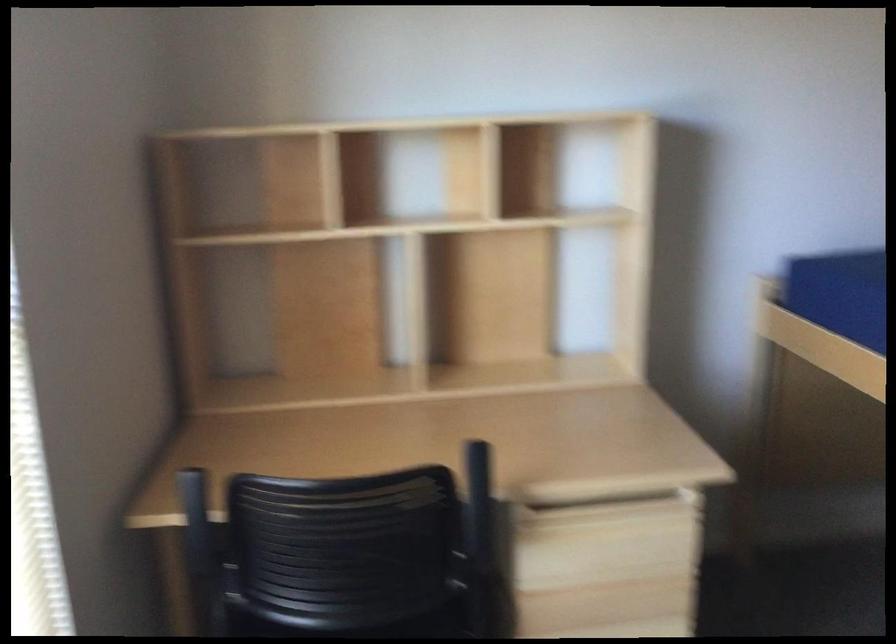
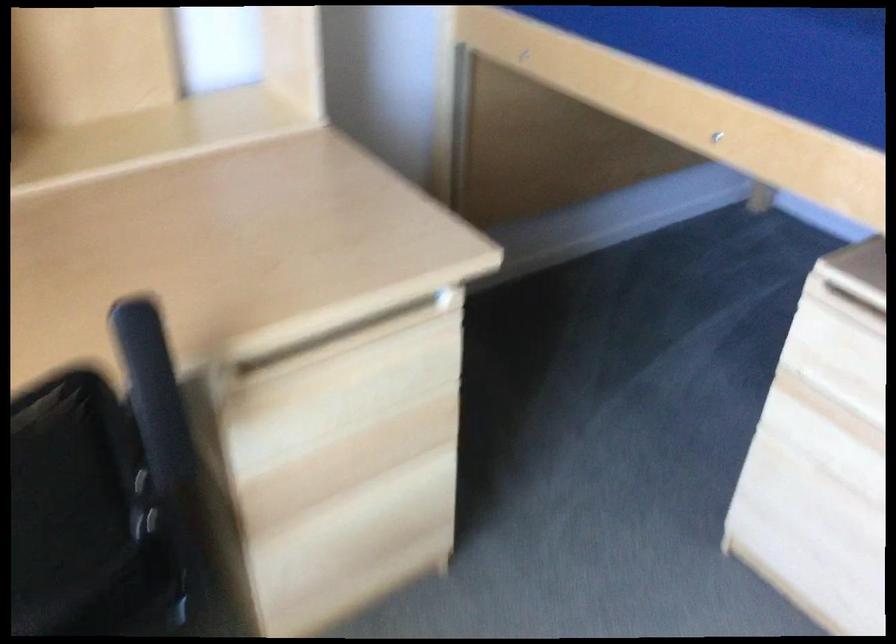
First-person continuous shooting, in which direction is the camera rotating?

The camera rotated toward right-down.